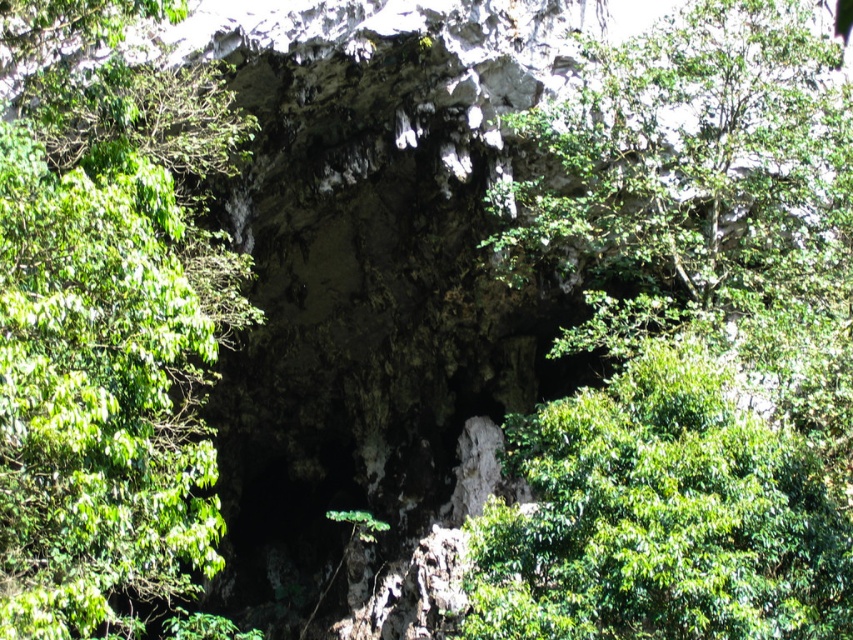
You are standing in front of the rock formation and want to identify the position of the green leafy tree at center relative to the green leafy tree at upper left. Based on the scene, which tree is higher up in the image?

The green leafy tree at center is higher up in the image than the green leafy tree at upper left because it is positioned above it.